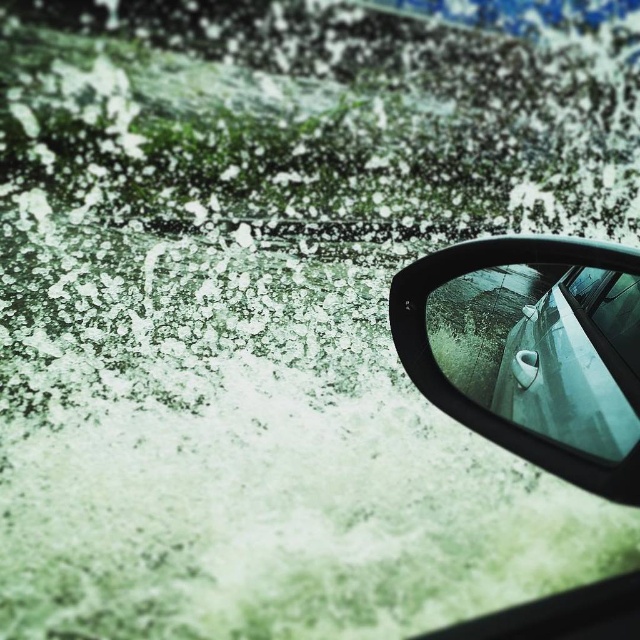
Question: Is black glossy car mirror at upper right to the left of clear glass car window at center from the viewer's perspective?

Choices:
 (A) yes
 (B) no

Answer: (A)

Question: Does black glossy car mirror at upper right lie behind clear glass car window at center?

Choices:
 (A) yes
 (B) no

Answer: (B)

Question: Does black glossy car mirror at upper right appear on the left side of clear glass car window at center?

Choices:
 (A) yes
 (B) no

Answer: (A)

Question: Among these objects, which one is farthest from the camera?

Choices:
 (A) clear glass car window at center
 (B) black glossy car mirror at upper right

Answer: (A)

Question: Which object is farther from the camera taking this photo?

Choices:
 (A) black glossy car mirror at upper right
 (B) clear glass car window at center

Answer: (B)